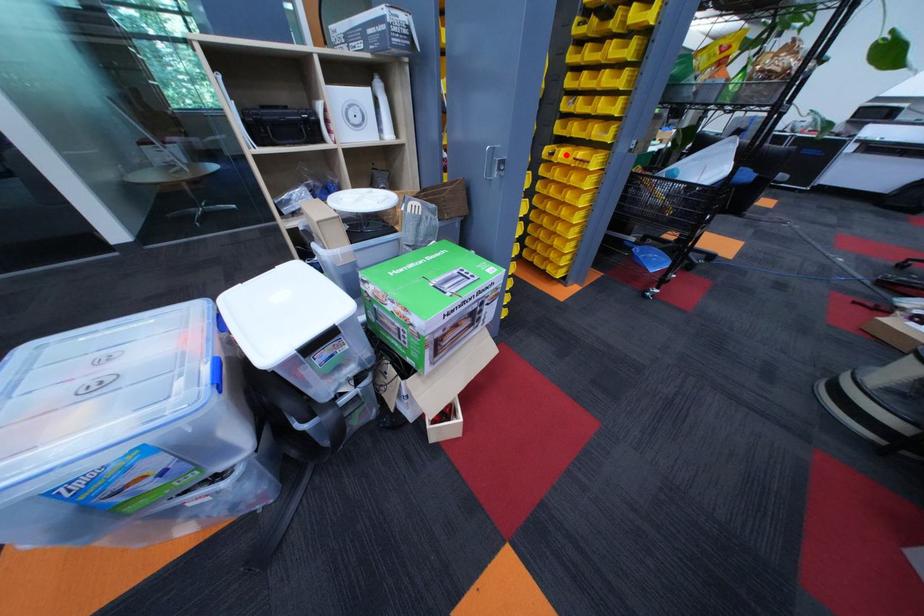
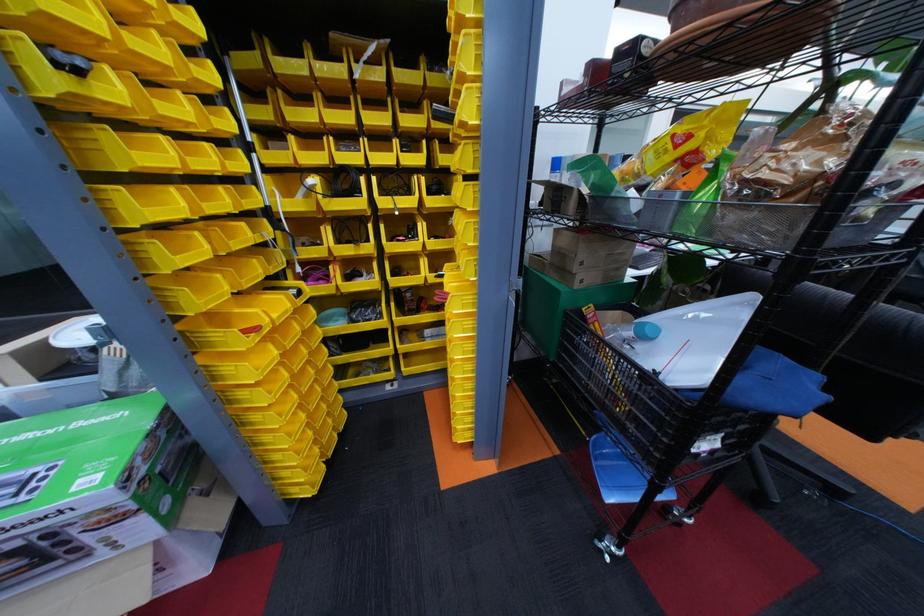
In the second image, find the point that corresponds to the highlighted location in the first image.

(456, 277)